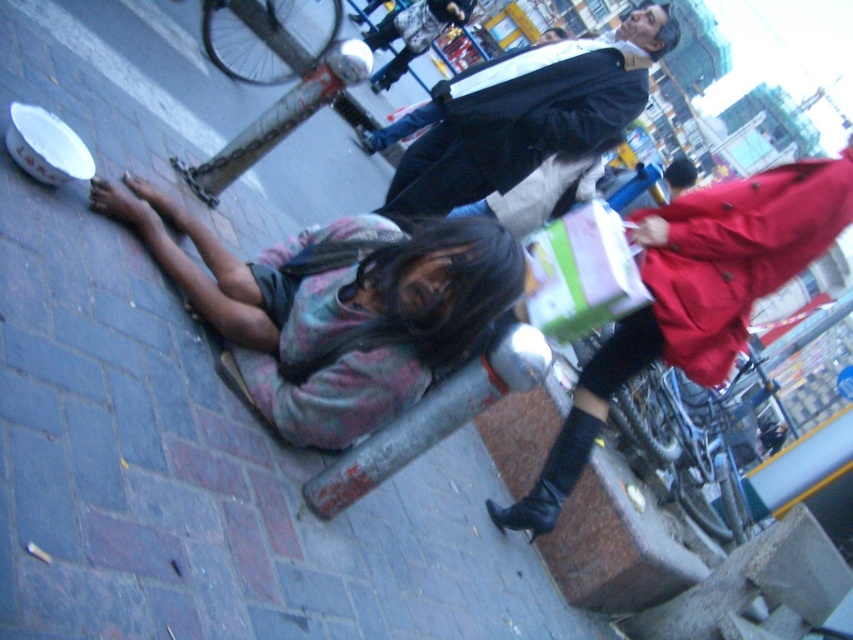
Question: Which point appears farthest from the camera in this image?

Choices:
 (A) (500, 554)
 (B) (595, 77)
 (C) (438, 230)

Answer: (B)

Question: Which object appears closest to the camera in this image?

Choices:
 (A) dark blue leather jacket at upper center
 (B) brick pavement at lower left
 (C) multicolored fabric at lower left

Answer: (B)

Question: Is brick pavement at lower left smaller than multicolored fabric at lower left?

Choices:
 (A) no
 (B) yes

Answer: (A)

Question: Is multicolored fabric at lower left to the right of dark blue leather jacket at upper center from the viewer's perspective?

Choices:
 (A) yes
 (B) no

Answer: (B)

Question: Observing the image, what is the correct spatial positioning of brick pavement at lower left in reference to dark blue leather jacket at upper center?

Choices:
 (A) right
 (B) left

Answer: (B)

Question: Which point is closer to the camera taking this photo?

Choices:
 (A) (308, 387)
 (B) (512, 182)

Answer: (A)